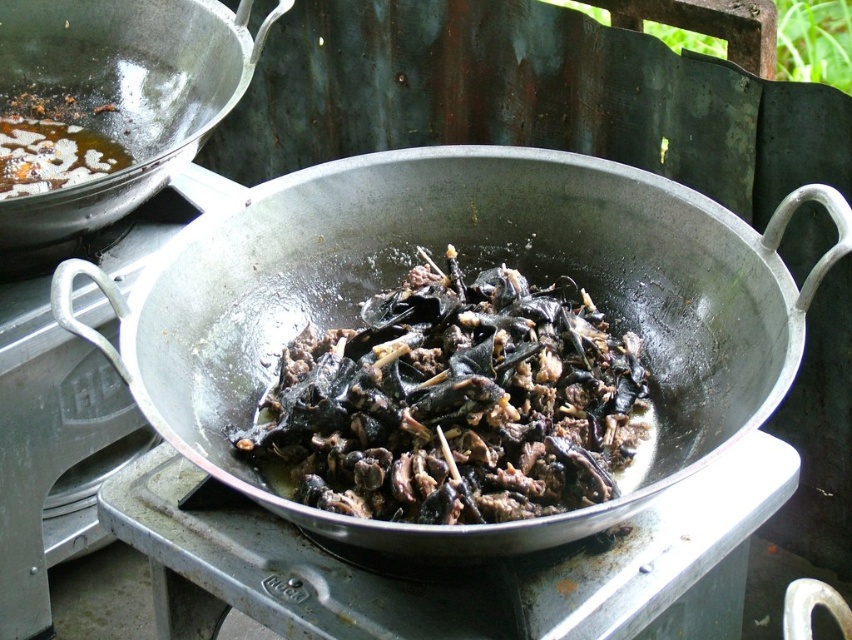
Is black matte wok at center below shiny metallic wok at upper left?

Correct, black matte wok at center is located below shiny metallic wok at upper left.

Can you confirm if black matte wok at center is shorter than shiny metallic wok at upper left?

Correct, black matte wok at center is not as tall as shiny metallic wok at upper left.

Identify the location of black matte wok at center. The width and height of the screenshot is (852, 640). (471, 264).

Does black matte food at center appear under shiny metallic wok at upper left?

Indeed, black matte food at center is positioned under shiny metallic wok at upper left.

Does black matte food at center appear on the right side of shiny metallic wok at upper left?

Yes, black matte food at center is to the right of shiny metallic wok at upper left.

Between point (620, 396) and point (213, 0), which one is positioned behind?

Point (213, 0)

You are a GUI agent. You are given a task and a screenshot of the screen. Output one action in this format:
    pyautogui.click(x=<x>, y=<y>)
    Task: Click on the black matte food at center
    Image resolution: width=852 pixels, height=640 pixels.
    Given the screenshot: What is the action you would take?
    pyautogui.click(x=455, y=403)

Can you confirm if black matte wok at center is positioned to the right of black matte food at center?

Indeed, black matte wok at center is positioned on the right side of black matte food at center.

Identify the location of black matte wok at center. Image resolution: width=852 pixels, height=640 pixels. (471, 264).

Image resolution: width=852 pixels, height=640 pixels. I want to click on black matte wok at center, so (471, 264).